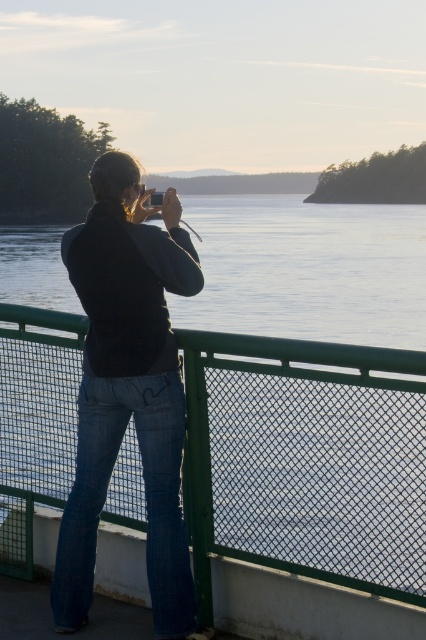
Question: Does green mesh fence at center lie behind denim jeans at center?

Choices:
 (A) yes
 (B) no

Answer: (B)

Question: Which object appears farthest from the camera in this image?

Choices:
 (A) denim jeans at center
 (B) green mesh fence at center

Answer: (A)

Question: Does green mesh fence at center have a larger size compared to denim jeans at center?

Choices:
 (A) yes
 (B) no

Answer: (A)

Question: Which object appears closest to the camera in this image?

Choices:
 (A) green mesh fence at center
 (B) denim jeans at center

Answer: (A)

Question: Can you confirm if green mesh fence at center is positioned above denim jeans at center?

Choices:
 (A) no
 (B) yes

Answer: (A)